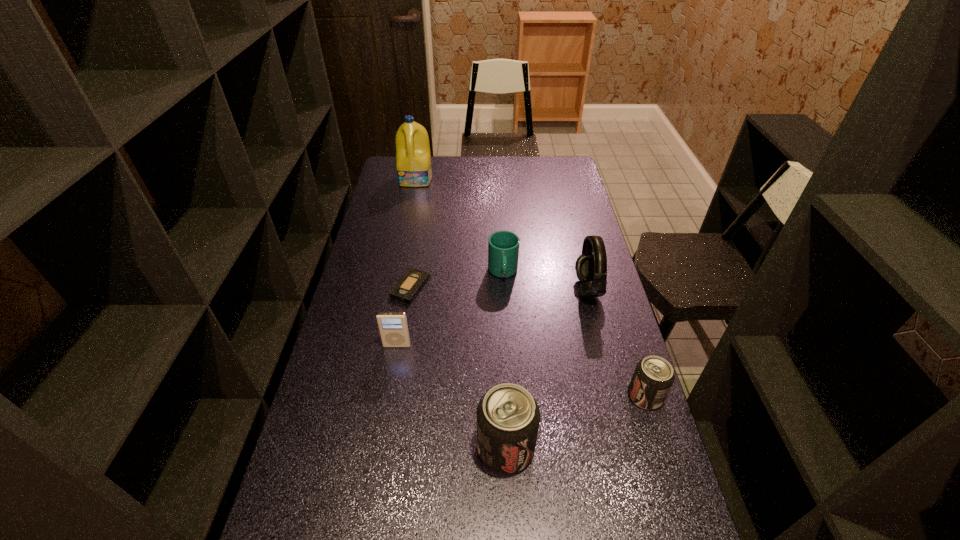
Find the location of a particular element. The image size is (960, 540). the nearest object is located at coordinates (508, 417).

Where is `the nearer soda can`? The height and width of the screenshot is (540, 960). the nearer soda can is located at coordinates (508, 417).

Identify the location of the shorter soda can. The height and width of the screenshot is (540, 960). pos(653,377).

This screenshot has height=540, width=960. What are the coordinates of `the sixth farthest object` in the screenshot? It's located at (653, 377).

Find the location of `detergent`. detergent is located at coordinates (413, 159).

At what (x,y) coordinates should I click in order to perform the action: click on the tallest object. Please return your answer as a coordinate pair (x, y). Looking at the image, I should click on (413, 159).

At what (x,y) coordinates should I click in order to perform the action: click on cup. Please return your answer as a coordinate pair (x, y). Looking at the image, I should click on (503, 246).

Identify the location of headset. Image resolution: width=960 pixels, height=540 pixels. (591, 267).

Find the location of a particular element. Image resolution: width=960 pixels, height=540 pixels. the third nearest object is located at coordinates (393, 327).

Find the location of `the shortest object`. the shortest object is located at coordinates (408, 287).